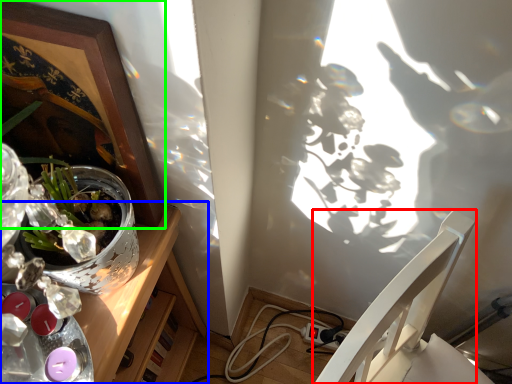
Question: Which object is the closest to the chair (highlighted by a red box)? Choose among these: desk (highlighted by a blue box) or picture frame (highlighted by a green box).

Choices:
 (A) desk
 (B) picture frame

Answer: (A)